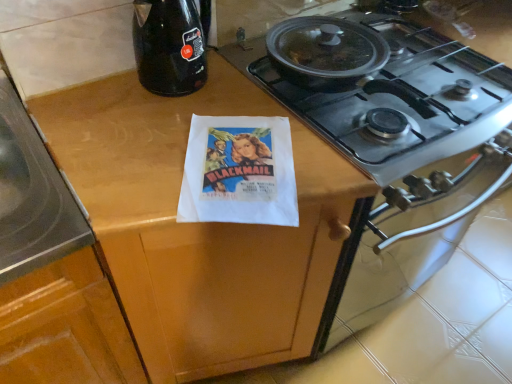
The image size is (512, 384). Find the location of `vacant area that lies to the right of black glass bottle at upper left`. vacant area that lies to the right of black glass bottle at upper left is located at coordinates (249, 97).